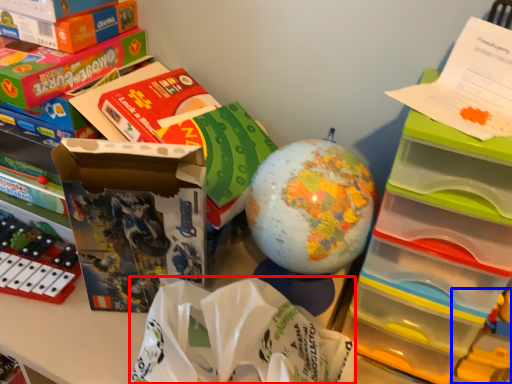
Question: Which object is closer to the camera taking this photo, paper bag (highlighted by a red box) or toy (highlighted by a blue box)?

Choices:
 (A) paper bag
 (B) toy

Answer: (A)